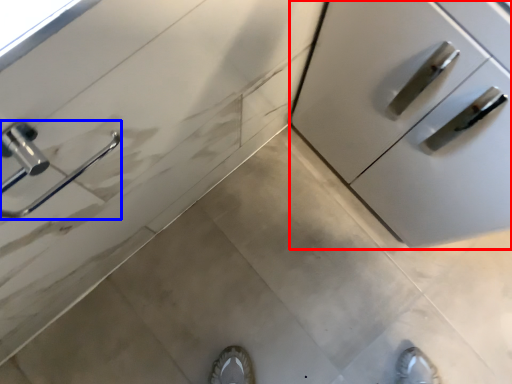
Question: Among these objects, which one is farthest to the camera, cabinetry (highlighted by a red box) or door handle (highlighted by a blue box)?

Choices:
 (A) cabinetry
 (B) door handle

Answer: (A)